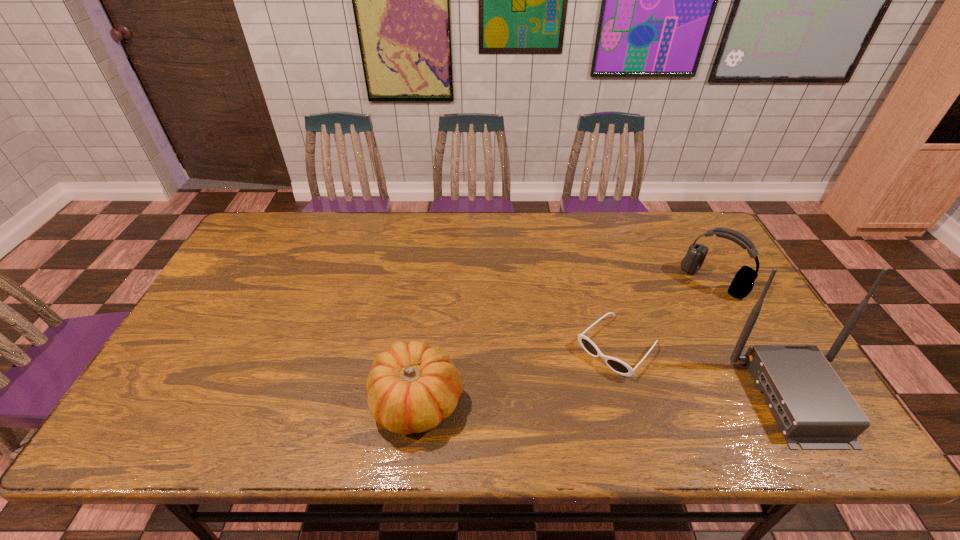
In the image, there is a desktop. Where is `vacant space at the left edge`? Image resolution: width=960 pixels, height=540 pixels. vacant space at the left edge is located at coordinates (260, 264).

In the image, there is a desktop. Where is `vacant space at the right edge`? Image resolution: width=960 pixels, height=540 pixels. vacant space at the right edge is located at coordinates [x=746, y=370].

You are a GUI agent. You are given a task and a screenshot of the screen. Output one action in this format:
    pyautogui.click(x=<x>, y=<y>)
    Task: Click on the vacant space at the far left corner
    Image resolution: width=960 pixels, height=540 pixels.
    Given the screenshot: What is the action you would take?
    pyautogui.click(x=278, y=244)

Where is `free point between the second object from left to right and the third shortest object`? Image resolution: width=960 pixels, height=540 pixels. free point between the second object from left to right and the third shortest object is located at coordinates (665, 314).

Where is `free area in between the leftmost object and the tallest object`? free area in between the leftmost object and the tallest object is located at coordinates (606, 399).

The image size is (960, 540). I want to click on vacant space in between the third object from right to left and the leftmost object, so [517, 374].

Find the location of a particular element. empty space between the router and the third tallest object is located at coordinates (606, 399).

Locate an element on the screen. Image resolution: width=960 pixels, height=540 pixels. free space between the headset and the gourd is located at coordinates (565, 341).

Identify the location of free space between the headset and the gourd. This screenshot has height=540, width=960. (565, 341).

The image size is (960, 540). I want to click on unoccupied area between the gourd and the shortest object, so click(517, 374).